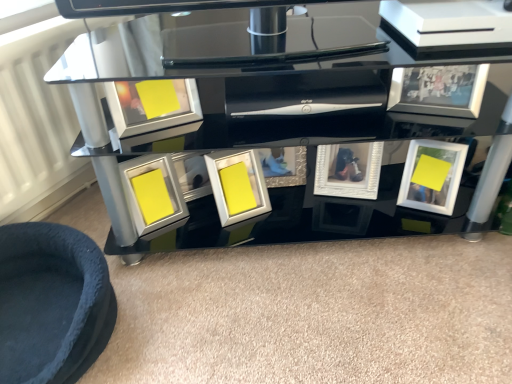
What do you see at coordinates (237, 185) in the screenshot? This screenshot has height=384, width=512. I see `white glossy picture frame at center, the fourth picture frame positioned from the right` at bounding box center [237, 185].

The height and width of the screenshot is (384, 512). What do you see at coordinates (264, 86) in the screenshot?
I see `black glass table at center` at bounding box center [264, 86].

You are a GUI agent. You are given a task and a screenshot of the screen. Output one action in this format:
    pyautogui.click(x=<x>, y=<y>)
    Task: Click on the black glass table at center
    The height and width of the screenshot is (384, 512).
    Given the screenshot: What is the action you would take?
    pyautogui.click(x=264, y=86)

What do you see at coordinates (49, 301) in the screenshot? I see `velvet blue pet bed at lower left` at bounding box center [49, 301].

What do you see at coordinates (432, 176) in the screenshot?
I see `white glossy picture frame at lower right, the 1th picture frame from the right` at bounding box center [432, 176].

Where is `white glossy picture frame at lower right, the sixth picture frame in the left-to-right sequence`? This screenshot has height=384, width=512. white glossy picture frame at lower right, the sixth picture frame in the left-to-right sequence is located at coordinates (432, 176).

Locate an element on the screen. The width and height of the screenshot is (512, 384). white textured frame at center, placed as the fourth picture frame when sorted from left to right is located at coordinates (348, 170).

Does white glossy picture frame at center, the fourth picture frame positioned from the right, have a greater width compared to metallic silver picture frame at upper right, the second picture frame in the right-to-left sequence?

Yes, white glossy picture frame at center, the fourth picture frame positioned from the right, is wider than metallic silver picture frame at upper right, the second picture frame in the right-to-left sequence.

Does white glossy picture frame at center, the fourth picture frame positioned from the right, contain metallic silver picture frame at upper right, positioned as the fifth picture frame in left-to-right order?

No, metallic silver picture frame at upper right, positioned as the fifth picture frame in left-to-right order, is not a part of white glossy picture frame at center, the fourth picture frame positioned from the right.

Looking at the image, does white glossy picture frame at center, the fourth picture frame positioned from the right, seem bigger or smaller compared to metallic silver picture frame at upper right, the second picture frame in the right-to-left sequence?

In the image, white glossy picture frame at center, the fourth picture frame positioned from the right, appears to be larger than metallic silver picture frame at upper right, the second picture frame in the right-to-left sequence.

Is white glossy picture frame at center, arranged as the third picture frame when viewed from the left, to the left or to the right of metallic silver picture frame at upper right, the second picture frame in the right-to-left sequence, in the image?

Clearly, white glossy picture frame at center, arranged as the third picture frame when viewed from the left, is on the left of metallic silver picture frame at upper right, the second picture frame in the right-to-left sequence, in the image.

From a real-world perspective, is metallic silver picture frame at upper right, positioned as the fifth picture frame in left-to-right order, over white glossy picture frame at lower right, the sixth picture frame in the left-to-right sequence?

Yes, from a real-world perspective, metallic silver picture frame at upper right, positioned as the fifth picture frame in left-to-right order, is over white glossy picture frame at lower right, the sixth picture frame in the left-to-right sequence

Is metallic silver picture frame at upper right, positioned as the fifth picture frame in left-to-right order, far from white glossy picture frame at lower right, the 1th picture frame from the right?

They are positioned close to each other.

Considering the sizes of metallic silver picture frame at upper right, positioned as the fifth picture frame in left-to-right order, and white glossy picture frame at lower right, the sixth picture frame in the left-to-right sequence, in the image, is metallic silver picture frame at upper right, positioned as the fifth picture frame in left-to-right order, bigger or smaller than white glossy picture frame at lower right, the sixth picture frame in the left-to-right sequence,?

In the image, metallic silver picture frame at upper right, positioned as the fifth picture frame in left-to-right order, appears to be larger than white glossy picture frame at lower right, the sixth picture frame in the left-to-right sequence.

Could you tell me if metallic silver picture frame at upper right, positioned as the fifth picture frame in left-to-right order, is turned towards white glossy picture frame at lower right, the 1th picture frame from the right?

No, metallic silver picture frame at upper right, positioned as the fifth picture frame in left-to-right order, does not turn towards white glossy picture frame at lower right, the 1th picture frame from the right.

From the image's perspective, relative to velvet blue pet bed at lower left, is metallic silver picture frame at upper right, positioned as the fifth picture frame in left-to-right order, above or below?

Clearly, from the image's perspective, metallic silver picture frame at upper right, positioned as the fifth picture frame in left-to-right order, is above velvet blue pet bed at lower left.

Which is behind, point (405, 70) or point (5, 373)?

The point (405, 70) is farther.

Based on their positions, is metallic silver picture frame at upper right, the second picture frame in the right-to-left sequence, located to the left or right of velvet blue pet bed at lower left?

Clearly, metallic silver picture frame at upper right, the second picture frame in the right-to-left sequence, is on the right of velvet blue pet bed at lower left in the image.

How different are the orientations of metallic silver picture frame at upper right, the second picture frame in the right-to-left sequence, and velvet blue pet bed at lower left in degrees?

70.2 degrees separate the facing orientations of metallic silver picture frame at upper right, the second picture frame in the right-to-left sequence, and velvet blue pet bed at lower left.

Can you confirm if white glossy picture frame at center, the fourth picture frame positioned from the right, is bigger than white textured frame at center, acting as the 3th picture frame starting from the right?

Correct, white glossy picture frame at center, the fourth picture frame positioned from the right, is larger in size than white textured frame at center, acting as the 3th picture frame starting from the right.

Between white glossy picture frame at center, arranged as the third picture frame when viewed from the left, and white textured frame at center, acting as the 3th picture frame starting from the right, which one has less height?

With less height is white glossy picture frame at center, arranged as the third picture frame when viewed from the left.

Considering the positions of objects white glossy picture frame at center, arranged as the third picture frame when viewed from the left, and white textured frame at center, acting as the 3th picture frame starting from the right, in the image provided, who is more to the left, white glossy picture frame at center, arranged as the third picture frame when viewed from the left, or white textured frame at center, acting as the 3th picture frame starting from the right,?

white glossy picture frame at center, arranged as the third picture frame when viewed from the left, is more to the left.

Can you tell me how much white glossy picture frame at center, arranged as the third picture frame when viewed from the left, and white textured frame at center, placed as the fourth picture frame when sorted from left to right, differ in facing direction?

The facing directions of white glossy picture frame at center, arranged as the third picture frame when viewed from the left, and white textured frame at center, placed as the fourth picture frame when sorted from left to right, are 37.8 degrees apart.

Is matte yellow picture frame at center, which appears as the 6th picture frame when viewed from the right, taller than metallic silver picture frame at upper right, the second picture frame in the right-to-left sequence?

Yes.

Is the position of matte yellow picture frame at center, the 1th picture frame viewed from the left, more distant than that of metallic silver picture frame at upper right, positioned as the fifth picture frame in left-to-right order?

Yes, the depth of matte yellow picture frame at center, the 1th picture frame viewed from the left, is greater than that of metallic silver picture frame at upper right, positioned as the fifth picture frame in left-to-right order.

This screenshot has height=384, width=512. I want to click on picture frame that is the 4th object to the right of the matte yellow picture frame at center, which appears as the 6th picture frame when viewed from the right, starting at the anchor, so pyautogui.click(x=439, y=90).

Based on the photo, can velvet blue pet bed at lower left be found inside black glass table at center?

No.

Does point (433, 228) come farther from viewer compared to point (64, 360)?

Yes, point (433, 228) is farther from viewer.

Does black glass table at center turn towards velvet blue pet bed at lower left?

No, black glass table at center is not oriented towards velvet blue pet bed at lower left.

From a real-world perspective, is black glass table at center on top of velvet blue pet bed at lower left?

Yes, from a real-world perspective, black glass table at center is above velvet blue pet bed at lower left.

Does point (402, 71) appear closer or farther from the camera than point (184, 94)?

Point (402, 71) is positioned farther from the camera compared to point (184, 94).

You are a GUI agent. You are given a task and a screenshot of the screen. Output one action in this format:
    pyautogui.click(x=<x>, y=<y>)
    Task: Click on the 1st picture frame behind the matte silver picture frame at upper left, the fifth picture frame positioned from the right
    The width and height of the screenshot is (512, 384).
    Given the screenshot: What is the action you would take?
    pyautogui.click(x=439, y=90)

Who is shorter, metallic silver picture frame at upper right, the second picture frame in the right-to-left sequence, or matte silver picture frame at upper left, which appears as the 2th picture frame when viewed from the left?

matte silver picture frame at upper left, which appears as the 2th picture frame when viewed from the left.

Does metallic silver picture frame at upper right, positioned as the fifth picture frame in left-to-right order, touch matte silver picture frame at upper left, the fifth picture frame positioned from the right?

No, metallic silver picture frame at upper right, positioned as the fifth picture frame in left-to-right order, is not beside matte silver picture frame at upper left, the fifth picture frame positioned from the right.

Which picture frame is the 2nd one when counting from the left side of the metallic silver picture frame at upper right, the second picture frame in the right-to-left sequence? Please provide its 2D coordinates.

[(237, 185)]

Find the location of `the 3rd picture frame below the metallic silver picture frame at upper right, the second picture frame in the right-to-left sequence (from a real-world perspective)`. the 3rd picture frame below the metallic silver picture frame at upper right, the second picture frame in the right-to-left sequence (from a real-world perspective) is located at coordinates (432, 176).

Based on the photo, considering their positions, is white glossy picture frame at lower right, the 1th picture frame from the right, positioned closer to metallic silver picture frame at upper right, the second picture frame in the right-to-left sequence, than black glass table at center?

white glossy picture frame at lower right, the 1th picture frame from the right, is positioned closer to the anchor metallic silver picture frame at upper right, the second picture frame in the right-to-left sequence.

Estimate the real-world distances between objects in this image. Which object is further from velvet blue pet bed at lower left, metallic silver picture frame at upper right, positioned as the fifth picture frame in left-to-right order, or matte silver picture frame at upper left, which appears as the 2th picture frame when viewed from the left?

metallic silver picture frame at upper right, positioned as the fifth picture frame in left-to-right order, is further to velvet blue pet bed at lower left.

Based on the photo, considering their positions, is velvet blue pet bed at lower left positioned closer to matte yellow picture frame at center, the 1th picture frame viewed from the left, than white glossy picture frame at lower right, the sixth picture frame in the left-to-right sequence?

velvet blue pet bed at lower left is positioned closer to the anchor matte yellow picture frame at center, the 1th picture frame viewed from the left.

From the image, which object appears to be nearer to metallic silver picture frame at upper right, the second picture frame in the right-to-left sequence, white textured frame at center, acting as the 3th picture frame starting from the right, or velvet blue pet bed at lower left?

white textured frame at center, acting as the 3th picture frame starting from the right.

Estimate the real-world distances between objects in this image. Which object is closer to matte yellow picture frame at center, the 1th picture frame viewed from the left, matte silver picture frame at upper left, which appears as the 2th picture frame when viewed from the left, or white textured frame at center, placed as the fourth picture frame when sorted from left to right?

Based on the image, matte silver picture frame at upper left, which appears as the 2th picture frame when viewed from the left, appears to be nearer to matte yellow picture frame at center, the 1th picture frame viewed from the left.

Looking at the image, which one is located closer to white textured frame at center, acting as the 3th picture frame starting from the right, velvet blue pet bed at lower left or white glossy picture frame at center, arranged as the third picture frame when viewed from the left?

Based on the image, white glossy picture frame at center, arranged as the third picture frame when viewed from the left, appears to be nearer to white textured frame at center, acting as the 3th picture frame starting from the right.

Which object lies further to the anchor point black glass table at center, matte yellow picture frame at center, the 1th picture frame viewed from the left, or white glossy picture frame at center, the fourth picture frame positioned from the right?

Among the two, matte yellow picture frame at center, the 1th picture frame viewed from the left, is located further to black glass table at center.

Estimate the real-world distances between objects in this image. Which object is closer to white textured frame at center, placed as the fourth picture frame when sorted from left to right, black glass table at center or matte silver picture frame at upper left, which appears as the 2th picture frame when viewed from the left?

The object closer to white textured frame at center, placed as the fourth picture frame when sorted from left to right, is black glass table at center.

The height and width of the screenshot is (384, 512). Find the location of `table between matte yellow picture frame at center, the 1th picture frame viewed from the left, and white glossy picture frame at lower right, the sixth picture frame in the left-to-right sequence, from left to right`. table between matte yellow picture frame at center, the 1th picture frame viewed from the left, and white glossy picture frame at lower right, the sixth picture frame in the left-to-right sequence, from left to right is located at coordinates (264, 86).

Identify the location of table between white glossy picture frame at center, the fourth picture frame positioned from the right, and metallic silver picture frame at upper right, the second picture frame in the right-to-left sequence. The height and width of the screenshot is (384, 512). (264, 86).

At what (x,y) coordinates should I click in order to perform the action: click on picture frame between matte silver picture frame at upper left, which appears as the 2th picture frame when viewed from the left, and white textured frame at center, placed as the fourth picture frame when sorted from left to right, in the horizontal direction. Please return your answer as a coordinate pair (x, y). This screenshot has height=384, width=512. Looking at the image, I should click on (237, 185).

Find the location of a particular element. table located between matte silver picture frame at upper left, which appears as the 2th picture frame when viewed from the left, and white textured frame at center, acting as the 3th picture frame starting from the right, in the left-right direction is located at coordinates (264, 86).